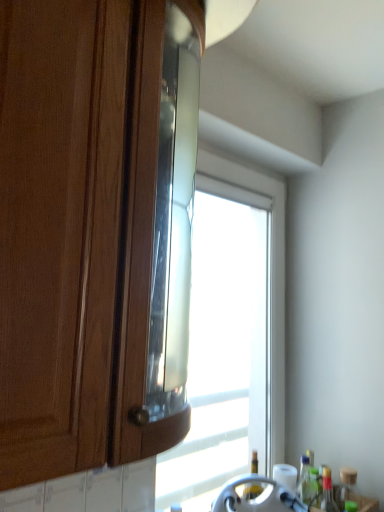
Describe the element at coordinates (345, 486) in the screenshot. The height and width of the screenshot is (512, 384). I see `translucent glass bottle at lower right, which appears as the first bottle when viewed from the right` at that location.

In the scene shown: In order to face transparent glass bottle at lower right, placed as the third bottle when sorted from right to left, should I rotate leftwards or rightwards?

You should rotate right by 15.298 degrees.

Measure the distance between point (306, 466) and camera.

Point (306, 466) and camera are 5.22 feet apart from each other.

At what (x,y) coordinates should I click in order to perform the action: click on matte wood cabinet at left. Please return your answer as a coordinate pair (x, y). This screenshot has width=384, height=512. Looking at the image, I should click on (95, 230).

This screenshot has height=512, width=384. What do you see at coordinates (328, 492) in the screenshot?
I see `translucent plastic bottle at lower right, the second bottle viewed from the right` at bounding box center [328, 492].

Identify the location of translucent glass bottle at lower right, which appears as the first bottle when viewed from the right. (345, 486).

The height and width of the screenshot is (512, 384). Identify the location of the 1st bottle below when counting from the matte wood cabinet at left (from the image's perspective). (304, 480).

Which of these two, matte wood cabinet at left or transparent glass bottle at lower right, placed as the third bottle when sorted from right to left, is bigger?

matte wood cabinet at left.

Is matte wood cabinet at left next to transparent glass bottle at lower right, placed as the 1th bottle when sorted from left to right?

There is a gap between matte wood cabinet at left and transparent glass bottle at lower right, placed as the 1th bottle when sorted from left to right.

Is point (147, 424) closer to viewer compared to point (301, 484)?

Yes, it is in front of point (301, 484).

From a real-world perspective, which object rests below the other?

translucent plastic bottle at lower right, the second bottle when ordered from left to right.

Is matte wood cabinet at left turned away from translucent plastic bottle at lower right, the second bottle viewed from the right?

No, matte wood cabinet at left is not facing the opposite direction of translucent plastic bottle at lower right, the second bottle viewed from the right.

From the image's perspective, which is above, translucent glass bottle at lower right, the 3th bottle positioned from the left, or metallic silver faucet at lower center?

metallic silver faucet at lower center appears higher in the image.

Would you say translucent glass bottle at lower right, the 3th bottle positioned from the left, contains metallic silver faucet at lower center?

That's incorrect, metallic silver faucet at lower center is not inside translucent glass bottle at lower right, the 3th bottle positioned from the left.

Looking at this image, is translucent glass bottle at lower right, the 3th bottle positioned from the left, with metallic silver faucet at lower center?

No, translucent glass bottle at lower right, the 3th bottle positioned from the left, is not next to metallic silver faucet at lower center.

Considering their positions, is translucent plastic bottle at lower right, the second bottle viewed from the right, located in front of or behind transparent glass bottle at lower right, placed as the 1th bottle when sorted from left to right?

Visually, translucent plastic bottle at lower right, the second bottle viewed from the right, is located in front of transparent glass bottle at lower right, placed as the 1th bottle when sorted from left to right.

Is point (327, 509) farther from viewer compared to point (298, 487)?

That is True.

Is translucent plastic bottle at lower right, the second bottle when ordered from left to right, to the right of transparent glass bottle at lower right, placed as the third bottle when sorted from right to left, from the viewer's perspective?

Indeed, translucent plastic bottle at lower right, the second bottle when ordered from left to right, is positioned on the right side of transparent glass bottle at lower right, placed as the third bottle when sorted from right to left.

Is translucent plastic bottle at lower right, the second bottle when ordered from left to right, not near transparent glass bottle at lower right, placed as the third bottle when sorted from right to left?

translucent plastic bottle at lower right, the second bottle when ordered from left to right, is near transparent glass bottle at lower right, placed as the third bottle when sorted from right to left, not far away.

Are translucent glass bottle at lower right, the 3th bottle positioned from the left, and transparent glass bottle at lower right, placed as the 1th bottle when sorted from left to right, beside each other?

No, translucent glass bottle at lower right, the 3th bottle positioned from the left, is not touching transparent glass bottle at lower right, placed as the 1th bottle when sorted from left to right.

How many degrees apart are the facing directions of translucent glass bottle at lower right, the 3th bottle positioned from the left, and transparent glass bottle at lower right, placed as the 1th bottle when sorted from left to right?

There is a 0.00234-degree angle between the facing directions of translucent glass bottle at lower right, the 3th bottle positioned from the left, and transparent glass bottle at lower right, placed as the 1th bottle when sorted from left to right.

Is translucent glass bottle at lower right, which appears as the first bottle when viewed from the right, oriented away from transparent glass bottle at lower right, placed as the 1th bottle when sorted from left to right?

Absolutely, translucent glass bottle at lower right, which appears as the first bottle when viewed from the right, is directed away from transparent glass bottle at lower right, placed as the 1th bottle when sorted from left to right.

Which point is more forward, (342,488) or (299,476)?

The point (299,476) is more forward.

Is translucent glass bottle at lower right, which appears as the first bottle when viewed from the right, beside transparent glass window at center?

No, translucent glass bottle at lower right, which appears as the first bottle when viewed from the right, is not beside transparent glass window at center.

Locate an element on the screen. window that is in front of the translucent glass bottle at lower right, which appears as the first bottle when viewed from the right is located at coordinates (231, 335).

Considering the positions of point (348, 477) and point (227, 291), is point (348, 477) closer or farther from the camera than point (227, 291)?

Point (348, 477) is positioned closer to the camera compared to point (227, 291).

Do you think translucent glass bottle at lower right, the 3th bottle positioned from the left, is within transparent glass window at center, or outside of it?

translucent glass bottle at lower right, the 3th bottle positioned from the left, is outside transparent glass window at center.

Is metallic silver faucet at lower center in contact with translucent plastic bottle at lower right, the second bottle when ordered from left to right?

No.

From a real-world perspective, between metallic silver faucet at lower center and translucent plastic bottle at lower right, the second bottle viewed from the right, who is vertically higher?

metallic silver faucet at lower center.

Considering the relative sizes of metallic silver faucet at lower center and translucent plastic bottle at lower right, the second bottle when ordered from left to right, in the image provided, is metallic silver faucet at lower center taller than translucent plastic bottle at lower right, the second bottle when ordered from left to right,?

Incorrect, the height of metallic silver faucet at lower center is not larger of that of translucent plastic bottle at lower right, the second bottle when ordered from left to right.

Is metallic silver faucet at lower center not inside translucent plastic bottle at lower right, the second bottle when ordered from left to right?

metallic silver faucet at lower center lies outside translucent plastic bottle at lower right, the second bottle when ordered from left to right,'s area.

Locate an element on the screen. Image resolution: width=384 pixels, height=512 pixels. bottle that is the 1st one below the matte wood cabinet at left (from a real-world perspective) is located at coordinates (304, 480).

I want to click on cabinetry on the left of translucent plastic bottle at lower right, the second bottle when ordered from left to right, so click(x=95, y=230).

In the scene shown: Considering their positions, is translucent glass bottle at lower right, the 3th bottle positioned from the left, positioned further to transparent glass window at center than transparent glass bottle at lower right, placed as the third bottle when sorted from right to left?

The object further to transparent glass window at center is translucent glass bottle at lower right, the 3th bottle positioned from the left.

From the image, which object appears to be farther from translucent glass bottle at lower right, which appears as the first bottle when viewed from the right, transparent glass window at center or matte wood cabinet at left?

matte wood cabinet at left lies further to translucent glass bottle at lower right, which appears as the first bottle when viewed from the right, than the other object.

When comparing their distances from metallic silver faucet at lower center, does transparent glass bottle at lower right, placed as the 1th bottle when sorted from left to right, or transparent glass window at center seem closer?

transparent glass bottle at lower right, placed as the 1th bottle when sorted from left to right, lies closer to metallic silver faucet at lower center than the other object.

Based on their spatial positions, is transparent glass bottle at lower right, placed as the third bottle when sorted from right to left, or transparent glass window at center closer to matte wood cabinet at left?

transparent glass window at center lies closer to matte wood cabinet at left than the other object.

Looking at this image, from the image, which object appears to be nearer to translucent plastic bottle at lower right, the second bottle viewed from the right, matte wood cabinet at left or transparent glass bottle at lower right, placed as the 1th bottle when sorted from left to right?

transparent glass bottle at lower right, placed as the 1th bottle when sorted from left to right, lies closer to translucent plastic bottle at lower right, the second bottle viewed from the right, than the other object.

Looking at the image, which one is located closer to translucent plastic bottle at lower right, the second bottle when ordered from left to right, transparent glass bottle at lower right, placed as the 1th bottle when sorted from left to right, or matte wood cabinet at left?

transparent glass bottle at lower right, placed as the 1th bottle when sorted from left to right, lies closer to translucent plastic bottle at lower right, the second bottle when ordered from left to right, than the other object.

Considering their positions, is matte wood cabinet at left positioned closer to translucent plastic bottle at lower right, the second bottle viewed from the right, than metallic silver faucet at lower center?

Based on the image, metallic silver faucet at lower center appears to be nearer to translucent plastic bottle at lower right, the second bottle viewed from the right.

Considering their positions, is translucent plastic bottle at lower right, the second bottle viewed from the right, positioned closer to matte wood cabinet at left than translucent glass bottle at lower right, which appears as the first bottle when viewed from the right?

translucent plastic bottle at lower right, the second bottle viewed from the right, is positioned closer to the anchor matte wood cabinet at left.

Locate an element on the screen. window between matte wood cabinet at left and translucent plastic bottle at lower right, the second bottle viewed from the right, from front to back is located at coordinates (231, 335).

Identify the location of appliance between matte wood cabinet at left and transparent glass bottle at lower right, placed as the third bottle when sorted from right to left, from front to back. This screenshot has height=512, width=384. (257, 496).

Locate an element on the screen. The image size is (384, 512). window located between matte wood cabinet at left and transparent glass bottle at lower right, placed as the 1th bottle when sorted from left to right, in the depth direction is located at coordinates (231, 335).

Where is `appliance positioned between matte wood cabinet at left and translucent glass bottle at lower right, the 3th bottle positioned from the left, from near to far`? This screenshot has height=512, width=384. appliance positioned between matte wood cabinet at left and translucent glass bottle at lower right, the 3th bottle positioned from the left, from near to far is located at coordinates (257, 496).